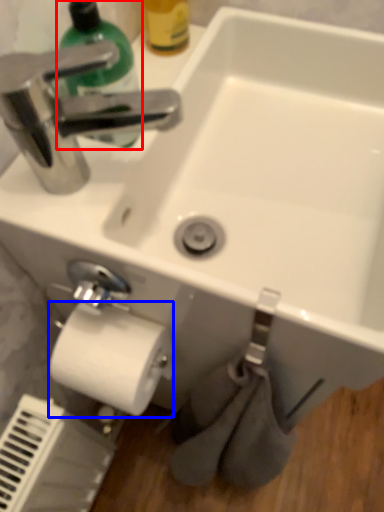
Question: Among these objects, which one is farthest to the camera, cleaning product (highlighted by a red box) or toilet paper (highlighted by a blue box)?

Choices:
 (A) cleaning product
 (B) toilet paper

Answer: (B)